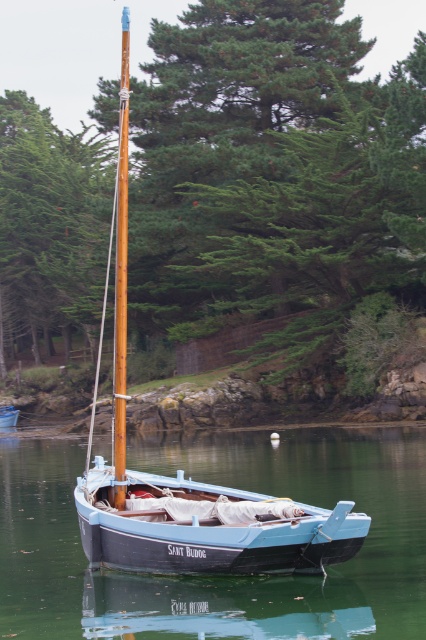
The height and width of the screenshot is (640, 426). Find the location of `wooden mast at center`. wooden mast at center is located at coordinates (120, 278).

Measure the distance between point (121, 483) and camera.

The distance of point (121, 483) from camera is 44.91 feet.

This screenshot has height=640, width=426. Find the location of `wooden mast at center`. wooden mast at center is located at coordinates (120, 278).

Measure the distance from green textured tree at upper left to light blue wooden boat at center.

green textured tree at upper left and light blue wooden boat at center are 211.95 feet apart.

Does green textured tree at upper left appear under light blue wooden boat at center?

Actually, green textured tree at upper left is above light blue wooden boat at center.

Where is `green textured tree at upper left`? This screenshot has height=640, width=426. green textured tree at upper left is located at coordinates 49,224.

Can you confirm if green textured tree at upper left is wider than wooden mast at center?

In fact, green textured tree at upper left might be narrower than wooden mast at center.

Find the location of a particular element. This screenshot has height=640, width=426. green textured tree at upper left is located at coordinates [49, 224].